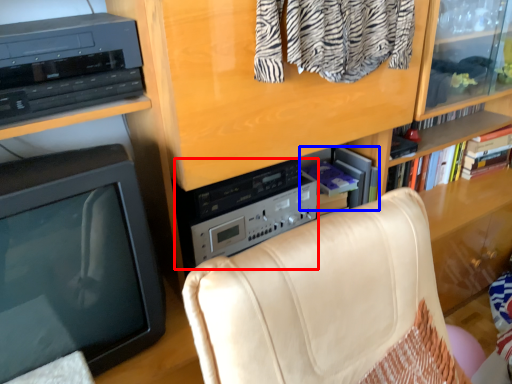
Question: Among these objects, which one is nearest to the camera, amplifier (highlighted by a red box) or book (highlighted by a blue box)?

Choices:
 (A) amplifier
 (B) book

Answer: (A)